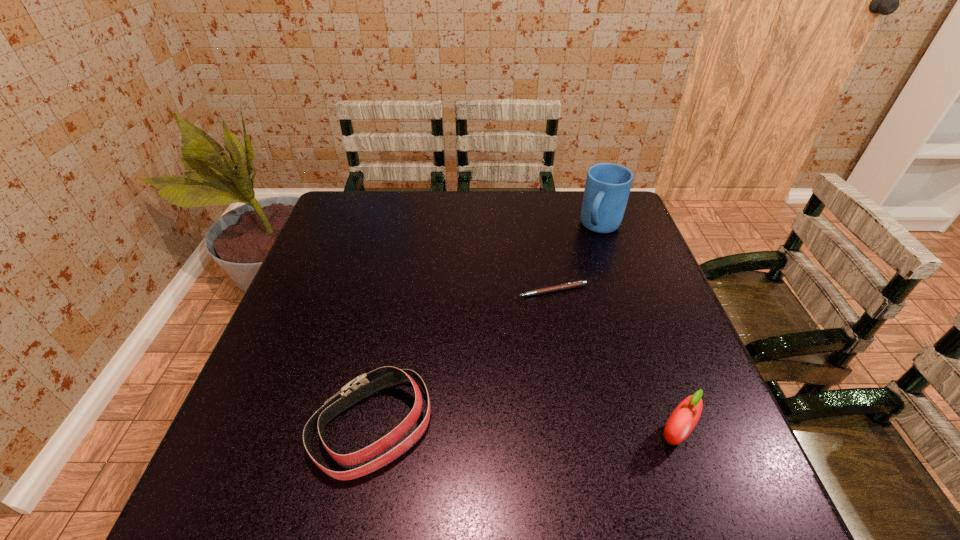
I want to click on the third tallest object, so click(x=364, y=385).

The width and height of the screenshot is (960, 540). I want to click on dog collar, so click(x=364, y=385).

You are a GUI agent. You are given a task and a screenshot of the screen. Output one action in this format:
    pyautogui.click(x=<x>, y=<y>)
    Task: Click on the second tallest object
    The height and width of the screenshot is (540, 960).
    Given the screenshot: What is the action you would take?
    pyautogui.click(x=684, y=418)

Find the location of a particular element. Image resolution: width=960 pixels, height=540 pixels. the tallest object is located at coordinates (607, 188).

The image size is (960, 540). What are the coordinates of `mug` in the screenshot? It's located at (607, 188).

Locate an element on the screen. The height and width of the screenshot is (540, 960). pen is located at coordinates (570, 285).

What are the coordinates of `the second farthest object` in the screenshot? It's located at (570, 285).

Locate an element on the screen. Image resolution: width=960 pixels, height=540 pixels. free space located on the back of the leftmost object is located at coordinates (396, 307).

You are a GUI agent. You are given a task and a screenshot of the screen. Output one action in this format:
    pyautogui.click(x=<x>, y=<y>)
    Task: Click on the vacant area located on the back of the third shortest object
    This screenshot has width=960, height=540.
    Given the screenshot: What is the action you would take?
    pyautogui.click(x=639, y=332)

Identify the location of free location located 0.150m on the side of the farthest object with the handle. (579, 272).